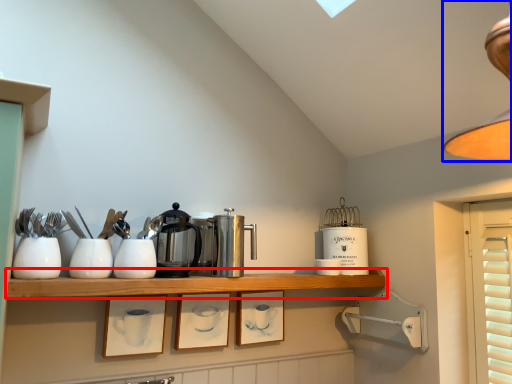
Question: Which object appears farthest to the camera in this image, shelf (highlighted by a red box) or lamp (highlighted by a blue box)?

Choices:
 (A) shelf
 (B) lamp

Answer: (A)